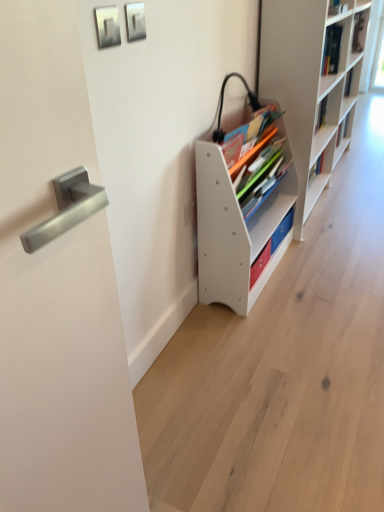
Where is `vacant area that lies to the right of white plastic shelf at center, the 1th shelf viewed from the left`? The image size is (384, 512). vacant area that lies to the right of white plastic shelf at center, the 1th shelf viewed from the left is located at coordinates (325, 264).